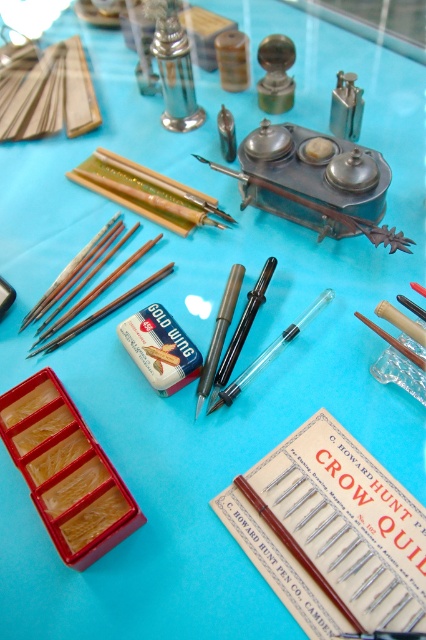
You are standing in front of the vintage writing tools display. There are two points marked on the image, one at coordinates point (310, 180) and the other at point (169, 269). Which point is closer to you?

Point (310, 180) is in front of point (169, 269), so it is closer to you.

You are an artist trying to choose between the matte black paint brush at center and the wooden paint brush at center for a detailed painting. Which brush has a smaller width?

The matte black paint brush at center has a smaller width than the wooden paint brush at center according to the description.